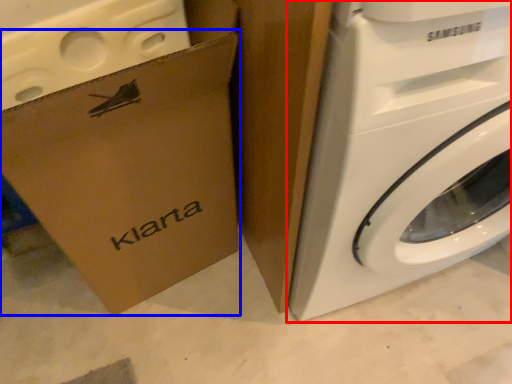
Question: Which object is closer to the camera taking this photo, washing machine (highlighted by a red box) or cardboard box (highlighted by a blue box)?

Choices:
 (A) washing machine
 (B) cardboard box

Answer: (A)